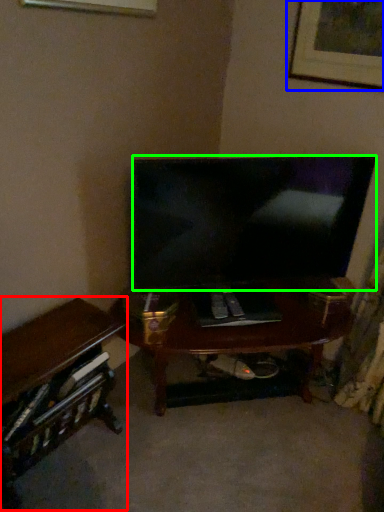
Question: Which object is the closest to the desk (highlighted by a red box)? Choose among these: picture frame (highlighted by a blue box) or television (highlighted by a green box).

Choices:
 (A) picture frame
 (B) television

Answer: (B)